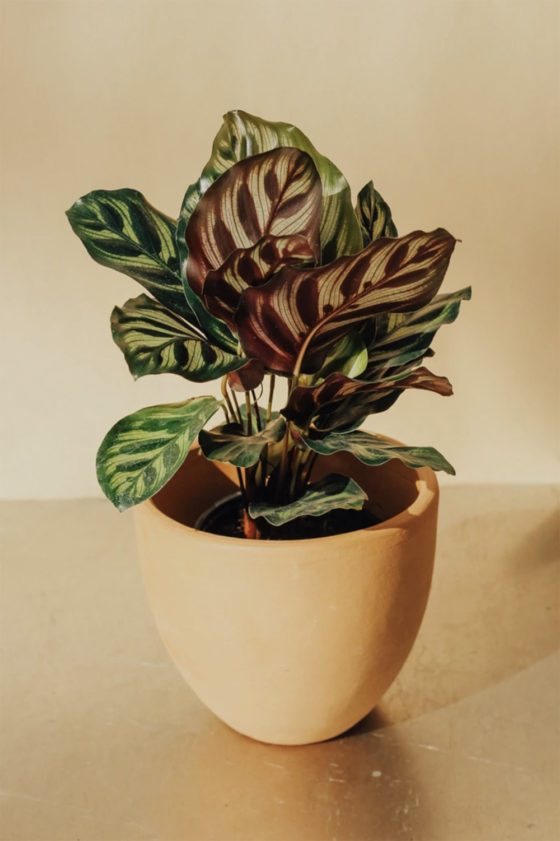
At what (x,y) coordinates should I click in order to perform the action: click on gold table. Please return your answer as a coordinate pair (x, y). Looking at the image, I should click on (361, 811).